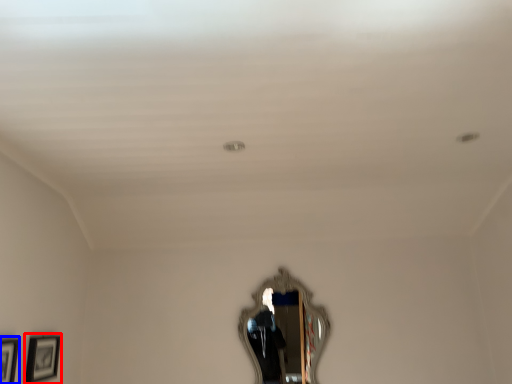
Question: Which of the following is the closest to the observer, picture frame (highlighted by a red box) or picture frame (highlighted by a blue box)?

Choices:
 (A) picture frame
 (B) picture frame

Answer: (B)